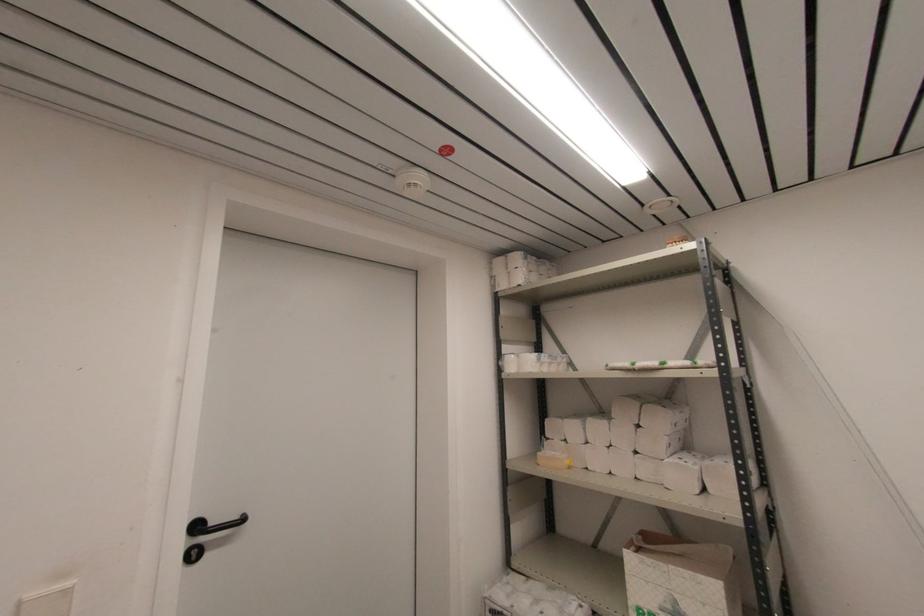
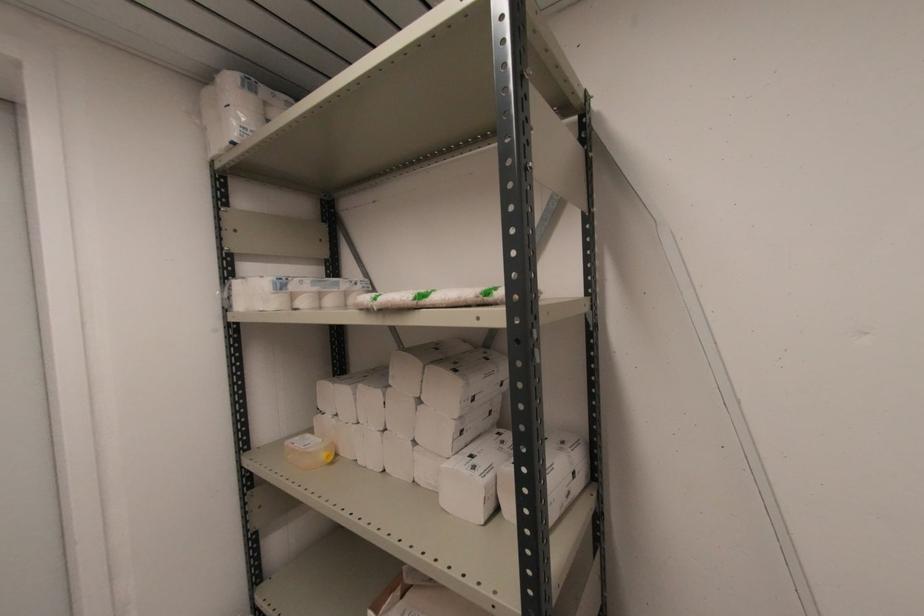
Locate, in the second image, the point that corresponds to point 517,286 in the first image.

(227, 144)